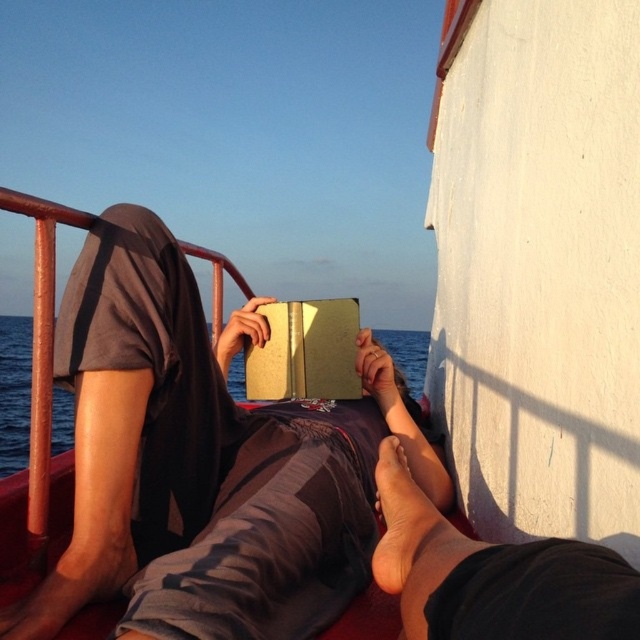
Which is above, matte brown book at center or brown skin at lower center?

matte brown book at center

Is matte brown book at center above brown skin at lower center?

Yes.

The width and height of the screenshot is (640, 640). What do you see at coordinates (205, 461) in the screenshot?
I see `matte brown book at center` at bounding box center [205, 461].

Locate an element on the screen. This screenshot has height=640, width=640. matte brown book at center is located at coordinates (205, 461).

Does leather-bound book at center have a greater height compared to gold paper book at center?

No.

Does leather-bound book at center appear on the left side of gold paper book at center?

In fact, leather-bound book at center is to the right of gold paper book at center.

Does point (328, 326) lie behind point (52, 445)?

No, it is in front of (52, 445).

What are the coordinates of `leather-bound book at center` in the screenshot? It's located at (305, 352).

Consider the image. Does leather-bound book at center have a lesser height compared to brown skin at lower center?

No.

Between leather-bound book at center and brown skin at lower center, which one is positioned higher?

Positioned higher is leather-bound book at center.

Find the location of `leather-bound book at center`. leather-bound book at center is located at coordinates click(x=305, y=352).